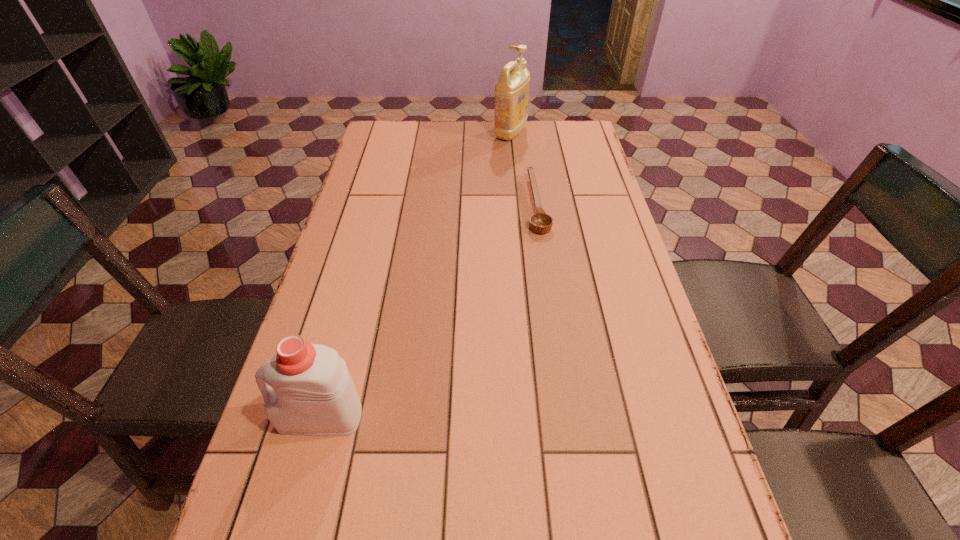
Locate an element on the screen. the right detergent is located at coordinates (511, 91).

This screenshot has height=540, width=960. I want to click on the tallest object, so click(x=511, y=91).

This screenshot has height=540, width=960. I want to click on the leftmost object, so click(x=311, y=393).

Where is `the nearest object`? the nearest object is located at coordinates (311, 393).

Locate an element on the screen. The height and width of the screenshot is (540, 960). the shortest object is located at coordinates (540, 222).

Identify the location of wooden spoon. pos(540,222).

In order to click on vacant space located 0.170m on the left of the right detergent in this screenshot , I will do `click(447, 132)`.

The height and width of the screenshot is (540, 960). What are the coordinates of `free point located 0.130m on the right of the second farthest object` in the screenshot? It's located at (591, 204).

In order to click on object present at the far edge in this screenshot , I will do `click(511, 91)`.

Find the location of a particular element. Image resolution: width=960 pixels, height=540 pixels. object at the left edge is located at coordinates (311, 393).